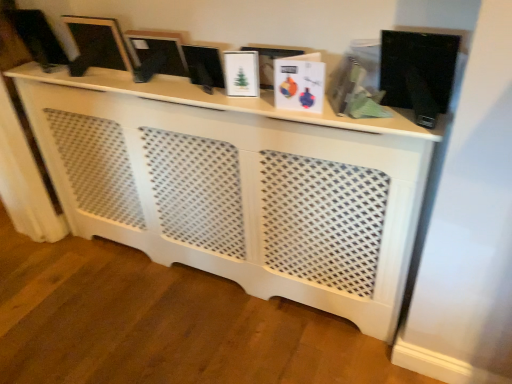
Question: Can you confirm if matte black monitor at upper left, marked as the 3th computer monitor in a right-to-left arrangement, is shorter than white lattice cabinet at center?

Choices:
 (A) no
 (B) yes

Answer: (B)

Question: Is matte black monitor at upper left, which is the 1th computer monitor in left-to-right order, not close to white lattice cabinet at center?

Choices:
 (A) no
 (B) yes

Answer: (A)

Question: Could white lattice cabinet at center be considered to be inside matte black monitor at upper left, marked as the 3th computer monitor in a right-to-left arrangement?

Choices:
 (A) yes
 (B) no

Answer: (B)

Question: Can you confirm if matte black monitor at upper left, marked as the 3th computer monitor in a right-to-left arrangement, is smaller than white lattice cabinet at center?

Choices:
 (A) no
 (B) yes

Answer: (B)

Question: Would you say matte black monitor at upper left, marked as the 3th computer monitor in a right-to-left arrangement, is outside white lattice cabinet at center?

Choices:
 (A) no
 (B) yes

Answer: (B)

Question: Is matte black monitor at upper left, which is the 1th computer monitor in left-to-right order, in front of white lattice cabinet at center?

Choices:
 (A) yes
 (B) no

Answer: (B)

Question: From the image's perspective, is matte black monitor at upper left, which is the 1th computer monitor in left-to-right order, below matte black frame at upper left, the second computer monitor viewed from the right?

Choices:
 (A) yes
 (B) no

Answer: (B)

Question: Considering the relative positions of matte black monitor at upper left, marked as the 3th computer monitor in a right-to-left arrangement, and matte black frame at upper left, the second computer monitor viewed from the left, in the image provided, is matte black monitor at upper left, marked as the 3th computer monitor in a right-to-left arrangement, behind matte black frame at upper left, the second computer monitor viewed from the left,?

Choices:
 (A) yes
 (B) no

Answer: (A)

Question: From a real-world perspective, is matte black monitor at upper left, marked as the 3th computer monitor in a right-to-left arrangement, on top of matte black frame at upper left, the second computer monitor viewed from the right?

Choices:
 (A) no
 (B) yes

Answer: (B)

Question: Considering the relative sizes of matte black monitor at upper left, which is the 1th computer monitor in left-to-right order, and matte black frame at upper left, the second computer monitor viewed from the right, in the image provided, is matte black monitor at upper left, which is the 1th computer monitor in left-to-right order, taller than matte black frame at upper left, the second computer monitor viewed from the right,?

Choices:
 (A) yes
 (B) no

Answer: (A)

Question: Does matte black monitor at upper left, marked as the 3th computer monitor in a right-to-left arrangement, appear on the right side of matte black frame at upper left, the second computer monitor viewed from the left?

Choices:
 (A) no
 (B) yes

Answer: (A)

Question: Does matte black monitor at upper left, which is the 1th computer monitor in left-to-right order, have a lesser width compared to matte black frame at upper left, the second computer monitor viewed from the left?

Choices:
 (A) no
 (B) yes

Answer: (A)

Question: Is black glossy computer monitor at center, arranged as the 1th computer monitor when viewed from the right, turned away from matte black monitor at upper left, marked as the 3th computer monitor in a right-to-left arrangement?

Choices:
 (A) yes
 (B) no

Answer: (B)